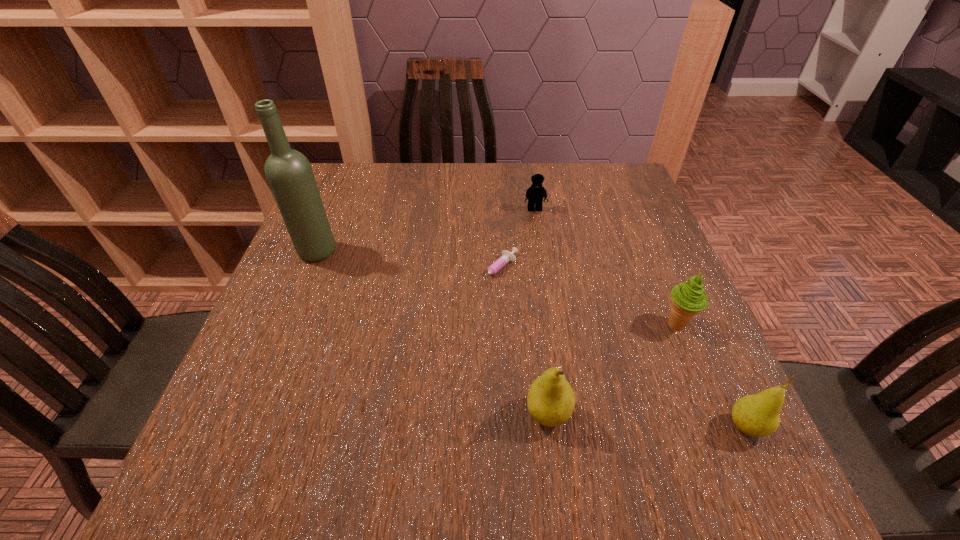
Locate an element on the screen. This screenshot has height=540, width=960. free region at the near edge is located at coordinates (453, 398).

In the image, there is a desktop. In order to click on vacant space at the right edge in this screenshot , I will do `click(670, 283)`.

Find the location of `free space at the far left corner of the desktop`. free space at the far left corner of the desktop is located at coordinates (334, 198).

Where is `free space at the far right corner of the desktop`? The image size is (960, 540). free space at the far right corner of the desktop is located at coordinates (614, 207).

At what (x,y) coordinates should I click in order to perform the action: click on vacant space at the near right corner. Please return your answer as a coordinate pair (x, y). The height and width of the screenshot is (540, 960). Looking at the image, I should click on (737, 434).

Locate an element on the screen. This screenshot has width=960, height=540. empty space between the taller pear and the syringe is located at coordinates (522, 343).

Identify the location of vacant point located between the left pear and the icecream. (612, 369).

Where is `free space that is in between the syringe and the taller pear`? Image resolution: width=960 pixels, height=540 pixels. free space that is in between the syringe and the taller pear is located at coordinates (522, 343).

At what (x,y) coordinates should I click in order to perform the action: click on vacant space in between the farthest object and the taller pear. Please return your answer as a coordinate pair (x, y). Looking at the image, I should click on (541, 312).

I want to click on free spot between the leftmost object and the Lego, so click(425, 231).